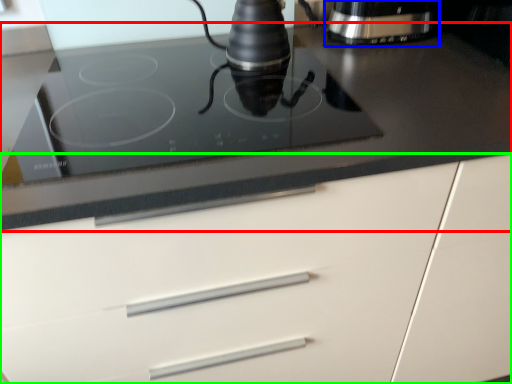
Question: Which is farther away from countertop (highlighted by a red box)? home appliance (highlighted by a blue box) or cabinetry (highlighted by a green box)?

Choices:
 (A) home appliance
 (B) cabinetry

Answer: (A)